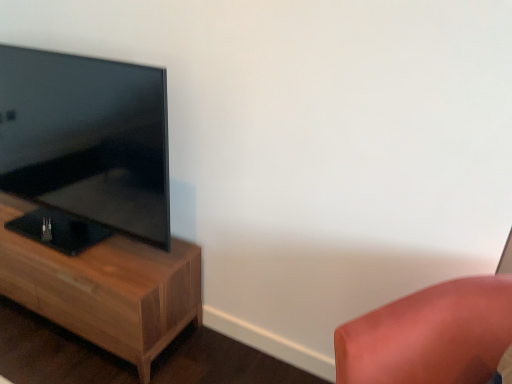
This screenshot has height=384, width=512. Identify the location of matte black tv at left. (87, 139).

Image resolution: width=512 pixels, height=384 pixels. What do you see at coordinates (105, 289) in the screenshot?
I see `wooden nightstand at left` at bounding box center [105, 289].

Locate an element on the screen. This screenshot has height=384, width=512. matte black tv at left is located at coordinates (87, 139).

Does wooden nightstand at left lie behind matte black tv at left?

Yes, wooden nightstand at left is behind matte black tv at left.

Considering the positions of points (92, 335) and (46, 128), is point (92, 335) farther from camera compared to point (46, 128)?

Yes, it is behind point (46, 128).

Consider the image. Looking at their sizes, would you say wooden nightstand at left is wider or thinner than matte black tv at left?

wooden nightstand at left is wider than matte black tv at left.

What are the coordinates of `television above the wooden nightstand at left (from a real-world perspective)` in the screenshot? It's located at (87, 139).

Who is bigger, satin pink cushion at lower right or matte black tv at left?

Bigger between the two is matte black tv at left.

Is satin pink cushion at lower right turned away from matte black tv at left?

No, satin pink cushion at lower right's orientation is not away from matte black tv at left.

Is satin pink cushion at lower right behind matte black tv at left?

No.

From a real-world perspective, between satin pink cushion at lower right and matte black tv at left, who is vertically lower?

From a 3D spatial view, satin pink cushion at lower right is below.

Is satin pink cushion at lower right touching wooden nightstand at left?

No, satin pink cushion at lower right is not making contact with wooden nightstand at left.

From a real-world perspective, between satin pink cushion at lower right and wooden nightstand at left, who is vertically higher?

In real-world perspective, satin pink cushion at lower right is above.

Considering the points (485, 352) and (64, 289), which point is in front, point (485, 352) or point (64, 289)?

The point (485, 352) is in front.

Would you say matte black tv at left is a long distance from wooden nightstand at left?

No, there isn't a large distance between matte black tv at left and wooden nightstand at left.

Who is more distant, matte black tv at left or wooden nightstand at left?

wooden nightstand at left is further from the camera.

How many degrees apart are the facing directions of matte black tv at left and wooden nightstand at left?

There is a 1.03-degree angle between the facing directions of matte black tv at left and wooden nightstand at left.

Considering the relative positions of matte black tv at left and wooden nightstand at left in the image provided, is matte black tv at left to the left or to the right of wooden nightstand at left?

From the image, it's evident that matte black tv at left is to the right of wooden nightstand at left.

Based on the photo, how distant is matte black tv at left from satin pink cushion at lower right?

matte black tv at left and satin pink cushion at lower right are 3.81 feet apart from each other.

Considering the relative sizes of matte black tv at left and satin pink cushion at lower right in the image provided, is matte black tv at left wider than satin pink cushion at lower right?

No.

Considering the positions of objects matte black tv at left and satin pink cushion at lower right in the image provided, who is more to the right, matte black tv at left or satin pink cushion at lower right?

Positioned to the right is satin pink cushion at lower right.

From a real-world perspective, who is located higher, matte black tv at left or satin pink cushion at lower right?

From a 3D spatial view, matte black tv at left is above.

Based on the photo, is wooden nightstand at left oriented towards satin pink cushion at lower right?

No, wooden nightstand at left is not aimed at satin pink cushion at lower right.

Is wooden nightstand at left positioned in front of satin pink cushion at lower right?

No, it is behind satin pink cushion at lower right.

Considering the points (32, 242) and (394, 308), which point is in front, point (32, 242) or point (394, 308)?

The point (394, 308) is more forward.

Looking at their sizes, would you say wooden nightstand at left is wider or thinner than satin pink cushion at lower right?

Clearly, wooden nightstand at left has less width compared to satin pink cushion at lower right.

Find the location of `nightstand lying on the left of matte black tv at left`. nightstand lying on the left of matte black tv at left is located at coordinates (105, 289).

Identify the location of television above the satin pink cushion at lower right (from the image's perspective). (87, 139).

Consider the image. Considering their positions, is wooden nightstand at left positioned further to satin pink cushion at lower right than matte black tv at left?

matte black tv at left is further to satin pink cushion at lower right.

Looking at this image, which object lies nearer to the anchor point matte black tv at left, satin pink cushion at lower right or wooden nightstand at left?

wooden nightstand at left is positioned closer to the anchor matte black tv at left.

Based on their spatial positions, is satin pink cushion at lower right or matte black tv at left closer to wooden nightstand at left?

matte black tv at left lies closer to wooden nightstand at left than the other object.

Based on their spatial positions, is matte black tv at left or satin pink cushion at lower right closer to wooden nightstand at left?

Based on the image, matte black tv at left appears to be nearer to wooden nightstand at left.

Which object lies further to the anchor point satin pink cushion at lower right, matte black tv at left or wooden nightstand at left?

The object further to satin pink cushion at lower right is matte black tv at left.

When comparing their distances from matte black tv at left, does wooden nightstand at left or satin pink cushion at lower right seem closer?

Based on the image, wooden nightstand at left appears to be nearer to matte black tv at left.

The image size is (512, 384). What are the coordinates of `television between wooden nightstand at left and satin pink cushion at lower right` in the screenshot? It's located at (87, 139).